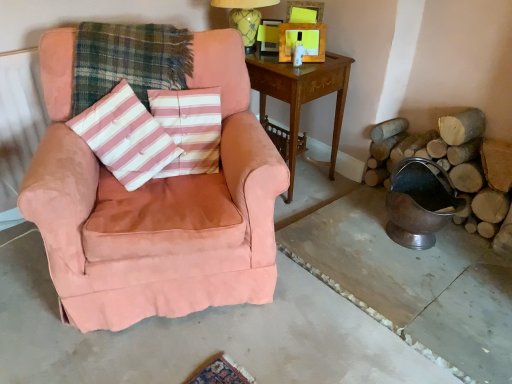
What do you see at coordinates (419, 203) in the screenshot? The image size is (512, 384). I see `polished silver swivel chair at lower right` at bounding box center [419, 203].

At what (x,y) coordinates should I click in order to perform the action: click on pink suede armchair at left. Please return your answer as a coordinate pair (x, y). This screenshot has height=384, width=512. Looking at the image, I should click on (197, 335).

Measure the distance between point (115, 139) and camera.

Point (115, 139) and camera are 5.65 feet apart.

Where is `pink striped fabric pillow at center`? The image size is (512, 384). pink striped fabric pillow at center is located at coordinates (190, 128).

Measure the distance between point (204, 106) and camera.

Point (204, 106) is 1.81 meters away from camera.

Find the location of a particular element. polished silver swivel chair at lower right is located at coordinates (419, 203).

Can you see yellow matte picture frame at upper center touching suede pink armchair at left?

No.

Find the location of a particular element. Image resolution: width=512 pixels, height=384 pixels. picture frame behind the suede pink armchair at left is located at coordinates (302, 41).

How much distance is there between yellow matte picture frame at upper center and suede pink armchair at left?

yellow matte picture frame at upper center and suede pink armchair at left are 89.86 centimeters apart from each other.

Could you tell me if pink suede armchair at left is facing wooden side table at center?

No, pink suede armchair at left is not oriented towards wooden side table at center.

Which is nearer, (296,329) or (291,139)?

The point (296,329) is closer to the camera.

Between pink suede armchair at left and wooden side table at center, which one is positioned behind?

wooden side table at center is behind.

Measure the distance from polished silver swivel chair at lower right to yellow glazed ceramic table lamp at upper center.

polished silver swivel chair at lower right and yellow glazed ceramic table lamp at upper center are 3.76 feet apart from each other.

Which of these two, polished silver swivel chair at lower right or yellow glazed ceramic table lamp at upper center, is smaller?

yellow glazed ceramic table lamp at upper center.

Is polished silver swivel chair at lower right placed right next to yellow glazed ceramic table lamp at upper center?

No, polished silver swivel chair at lower right is not touching yellow glazed ceramic table lamp at upper center.

Is polished silver swivel chair at lower right in front of or behind yellow glazed ceramic table lamp at upper center in the image?

polished silver swivel chair at lower right is positioned closer to the viewer than yellow glazed ceramic table lamp at upper center.

What's the angular difference between suede pink armchair at left and polished silver swivel chair at lower right's facing directions?

The angle between the facing direction of suede pink armchair at left and the facing direction of polished silver swivel chair at lower right is 21 degrees.

Considering the relative sizes of suede pink armchair at left and polished silver swivel chair at lower right in the image provided, is suede pink armchair at left wider than polished silver swivel chair at lower right?

Indeed, suede pink armchair at left has a greater width compared to polished silver swivel chair at lower right.

Considering the relative positions of suede pink armchair at left and polished silver swivel chair at lower right in the image provided, is suede pink armchair at left in front of polished silver swivel chair at lower right?

Yes, suede pink armchair at left is closer to the camera.

The width and height of the screenshot is (512, 384). In order to click on swivel chair below the natural wood logs at right (from the image's perspective) in this screenshot , I will do `click(419, 203)`.

Are polished silver swivel chair at lower right and natural wood logs at right located far from each other?

No, polished silver swivel chair at lower right is in close proximity to natural wood logs at right.

Looking at the image, does polished silver swivel chair at lower right seem bigger or smaller compared to natural wood logs at right?

polished silver swivel chair at lower right is bigger than natural wood logs at right.

From the image's perspective, which one is positioned higher, polished silver swivel chair at lower right or natural wood logs at right?

natural wood logs at right is shown above in the image.

Does plaid fabric at center have a greater width compared to wooden side table at center?

No, plaid fabric at center is not wider than wooden side table at center.

Based on the photo, is the position of plaid fabric at center less distant than that of wooden side table at center?

That is True.

Image resolution: width=512 pixels, height=384 pixels. I want to click on nightstand on the right of plaid fabric at center, so click(x=301, y=94).

How different are the orientations of polished silver swivel chair at lower right and plaid fabric at center in degrees?

They differ by 17.3 degrees in their facing directions.

Who is bigger, polished silver swivel chair at lower right or plaid fabric at center?

Bigger between the two is plaid fabric at center.

Would you consider polished silver swivel chair at lower right to be distant from plaid fabric at center?

Yes, polished silver swivel chair at lower right and plaid fabric at center are quite far apart.

I want to click on chair lying on the left of yellow matte picture frame at upper center, so click(x=155, y=207).

Where is `concrete that is below the wooden side table at center (from the image's perspective)`? The height and width of the screenshot is (384, 512). concrete that is below the wooden side table at center (from the image's perspective) is located at coordinates (197, 335).

Considering their positions, is yellow matte picture frame at upper center positioned closer to suede pink armchair at left than pink striped fabric pillow at center?

pink striped fabric pillow at center lies closer to suede pink armchair at left than the other object.

From the image, which object appears to be nearer to polished silver swivel chair at lower right, pink striped fabric pillow at center or suede pink armchair at left?

suede pink armchair at left is closer to polished silver swivel chair at lower right.

Which object lies nearer to the anchor point polished silver swivel chair at lower right, pink suede armchair at left or natural wood logs at right?

natural wood logs at right.

From the image, which object appears to be farther from polished silver swivel chair at lower right, yellow matte picture frame at upper center or yellow glazed ceramic table lamp at upper center?

Among the two, yellow glazed ceramic table lamp at upper center is located further to polished silver swivel chair at lower right.

Estimate the real-world distances between objects in this image. Which object is closer to yellow glazed ceramic table lamp at upper center, natural wood logs at right or yellow matte picture frame at upper center?

The object closer to yellow glazed ceramic table lamp at upper center is yellow matte picture frame at upper center.

Looking at this image, which object lies nearer to the anchor point yellow matte picture frame at upper center, suede pink armchair at left or plaid fabric at center?

The object closer to yellow matte picture frame at upper center is plaid fabric at center.

Estimate the real-world distances between objects in this image. Which object is further from yellow glazed ceramic table lamp at upper center, pink striped fabric pillow at center or natural wood logs at right?

natural wood logs at right is further to yellow glazed ceramic table lamp at upper center.

When comparing their distances from yellow matte picture frame at upper center, does natural wood logs at right or suede pink armchair at left seem closer?

The object closer to yellow matte picture frame at upper center is natural wood logs at right.

What are the coordinates of `concrete between plaid fabric at center and natural wood logs at right in the horizontal direction` in the screenshot? It's located at (197, 335).

You are a GUI agent. You are given a task and a screenshot of the screen. Output one action in this format:
    pyautogui.click(x=<x>, y=<y>)
    Task: Click on the throw pillow positioned between pink suede armchair at left and yellow matte picture frame at upper center from near to far
    
    Given the screenshot: What is the action you would take?
    [125, 137]

You are a GUI agent. You are given a task and a screenshot of the screen. Output one action in this format:
    pyautogui.click(x=<x>, y=<y>)
    Task: Click on the table lamp between pink striped fabric pillow at center and polished silver swivel chair at lower right in the horizontal direction
    
    Given the screenshot: What is the action you would take?
    pyautogui.click(x=245, y=16)

The image size is (512, 384). I want to click on concrete between plaid fabric at center and polished silver swivel chair at lower right, so click(x=197, y=335).